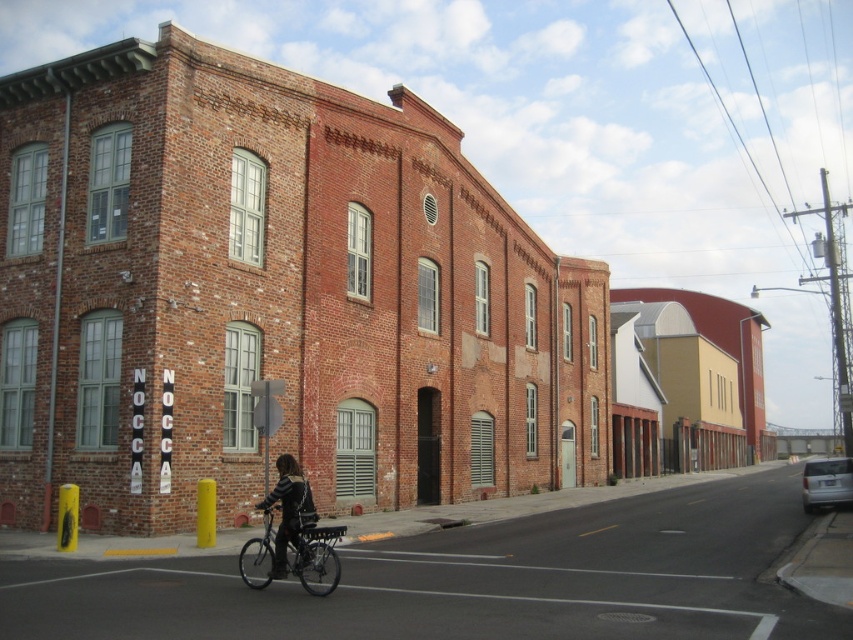
Question: Can you confirm if silver metallic bicycle at center is thinner than leather jacket at center?

Choices:
 (A) no
 (B) yes

Answer: (B)

Question: Which of the following is the closest to the observer?

Choices:
 (A) (334, 566)
 (B) (281, 564)

Answer: (B)

Question: Does silver metallic bicycle at center have a lesser width compared to leather jacket at center?

Choices:
 (A) no
 (B) yes

Answer: (B)

Question: Among these points, which one is farthest from the camera?

Choices:
 (A) (328, 564)
 (B) (289, 508)

Answer: (A)

Question: Can you confirm if silver metallic bicycle at center is smaller than leather jacket at center?

Choices:
 (A) no
 (B) yes

Answer: (B)